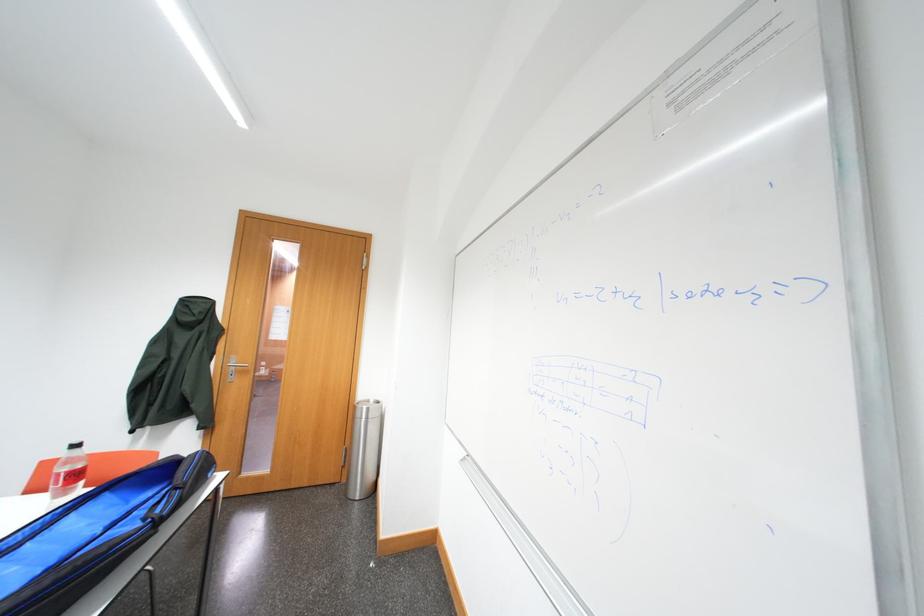
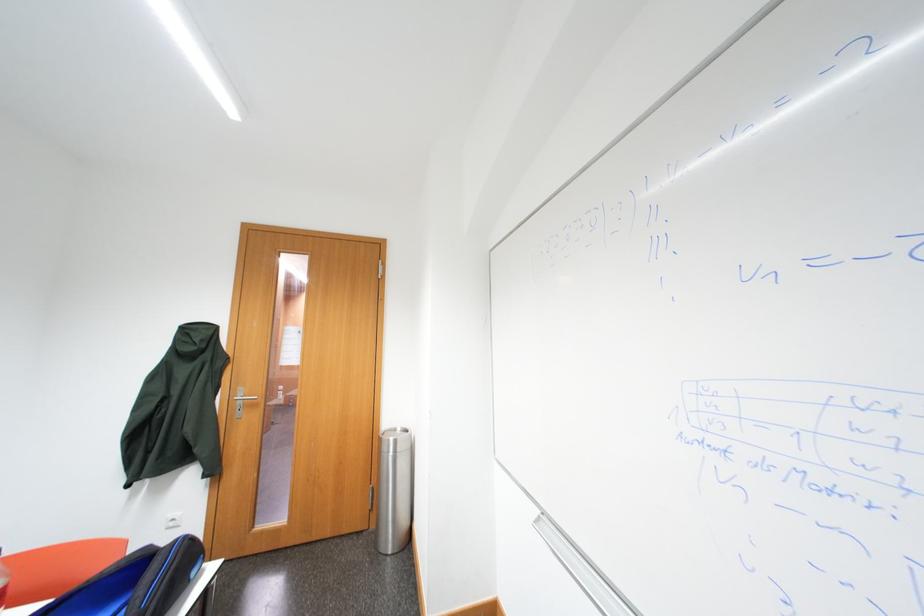
Question: How did the camera likely rotate?

Choices:
 (A) Left
 (B) Right
 (C) Up
 (D) Down

Answer: (A)